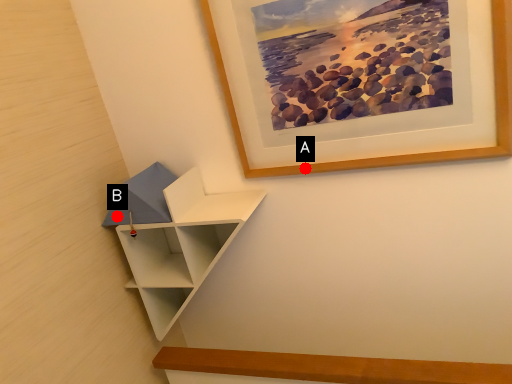
Question: Two points are circled on the image, labeled by A and B beside each circle. Which point appears closest to the camera in this image?

Choices:
 (A) A is closer
 (B) B is closer

Answer: (A)